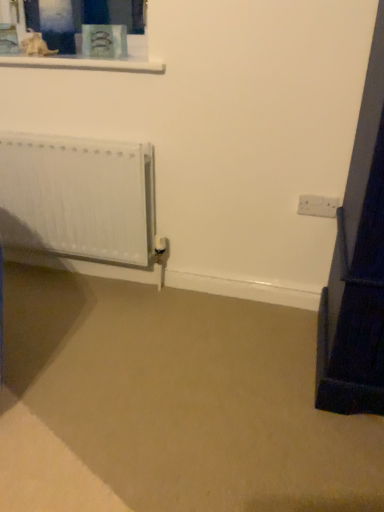
Question: In terms of size, does white plastic electric outlet at right appear bigger or smaller than white matte radiator at left?

Choices:
 (A) big
 (B) small

Answer: (B)

Question: Visually, is white plastic electric outlet at right positioned to the left or to the right of white matte radiator at left?

Choices:
 (A) right
 (B) left

Answer: (A)

Question: Considering the positions of point (309, 196) and point (107, 185), is point (309, 196) closer or farther from the camera than point (107, 185)?

Choices:
 (A) closer
 (B) farther

Answer: (A)

Question: Is white matte radiator at left taller or shorter than white plastic electric outlet at right?

Choices:
 (A) tall
 (B) short

Answer: (A)

Question: Considering the positions of white matte radiator at left and white plastic electric outlet at right in the image, is white matte radiator at left wider or thinner than white plastic electric outlet at right?

Choices:
 (A) thin
 (B) wide

Answer: (B)

Question: From the image's perspective, is white matte radiator at left located above or below white plastic electric outlet at right?

Choices:
 (A) below
 (B) above

Answer: (B)

Question: Choose the correct answer: Is white matte radiator at left inside white plastic electric outlet at right or outside it?

Choices:
 (A) outside
 (B) inside

Answer: (A)